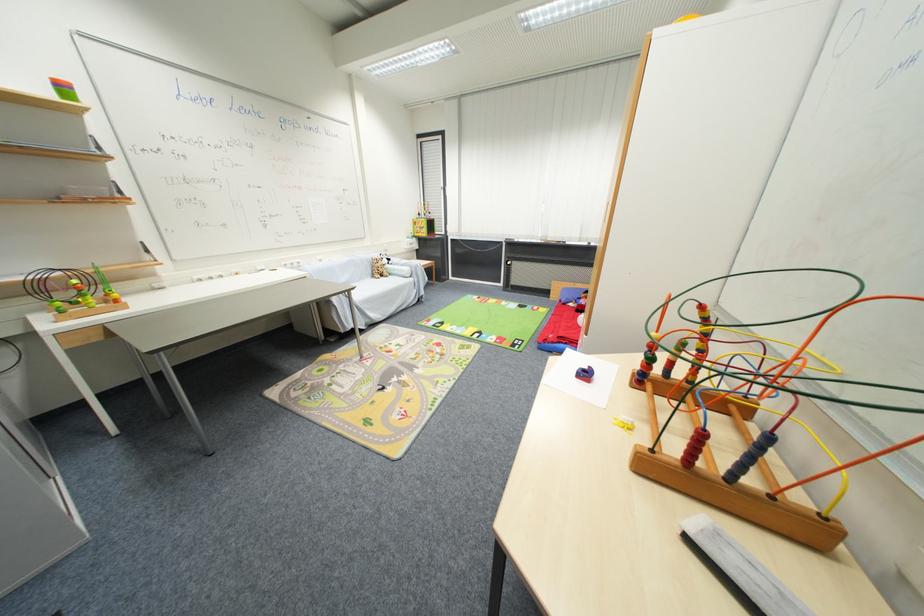
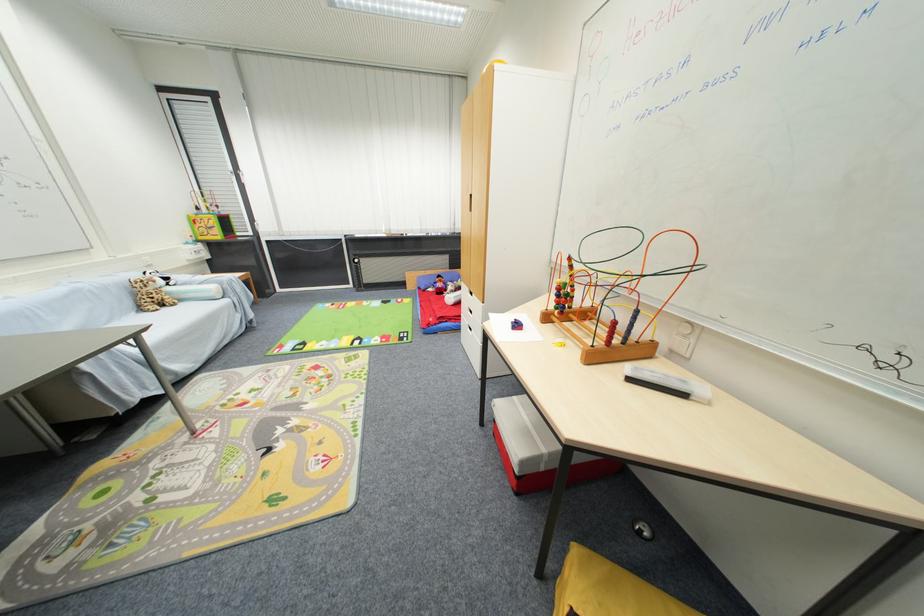
Where in the second image is the point corresponding to (379,277) from the first image?

(146, 310)